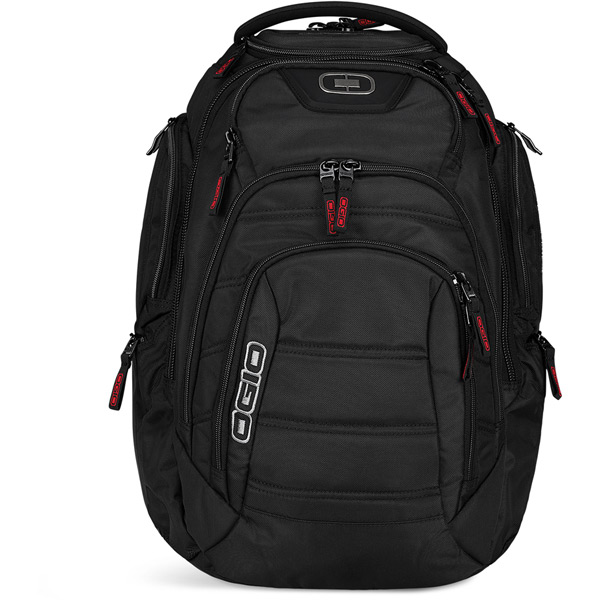
I want to click on upper right compartment, so click(523, 230).